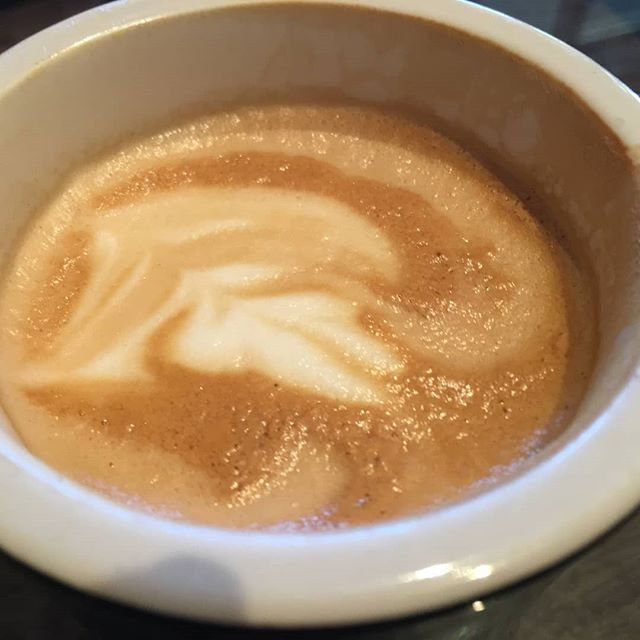
The height and width of the screenshot is (640, 640). What are the coordinates of `side of cup` in the screenshot? It's located at (505, 616).